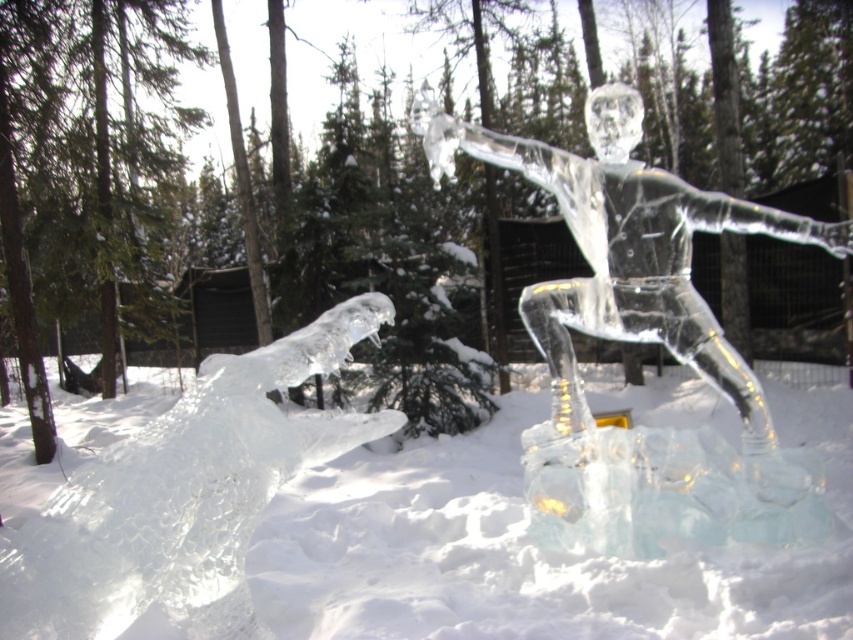
You are an ice sculptor who wants to transport both the transparent ice sculpture at center and the clear ice figure at center using a truck with a 2.5 meter wide loading bay. Can both sculptures fit side by side in the truck bed without overlapping?

The transparent ice sculpture at center is wider than the clear ice figure at center. Since the total width of both sculptures combined would exceed the 2.5 meter loading bay, they cannot fit side by side without overlapping.

You are an ice sculptor who wants to place a new ice sculpture between the clear ice figure at center and the clear ice dragon at lower left. The new sculpture is 3 feet wide. Can you fit it between them without moving the existing sculptures?

The clear ice figure at center and clear ice dragon at lower left are 6.77 feet apart from each other. Since the new sculpture is 3 feet wide, there is enough space between them to place it without moving the existing sculptures.

You are an ice sculptor who needs to place a 1.8 meter tall snowman next to the transparent ice sculpture at center and the clear ice figure at center. Which of the two ice sculptures will the snowman be taller than?

The transparent ice sculpture at center has a lesser height compared to clear ice figure at center. The snowman is 1.8 meters tall. If the clear ice figure at center is taller than the transparent ice sculpture at center, then the snowman could be taller than the transparent ice sculpture at center depending on their exact heights. However, without specific measurements for both ice sculptures, we cannot definitively determine which one the snowman is taller than.